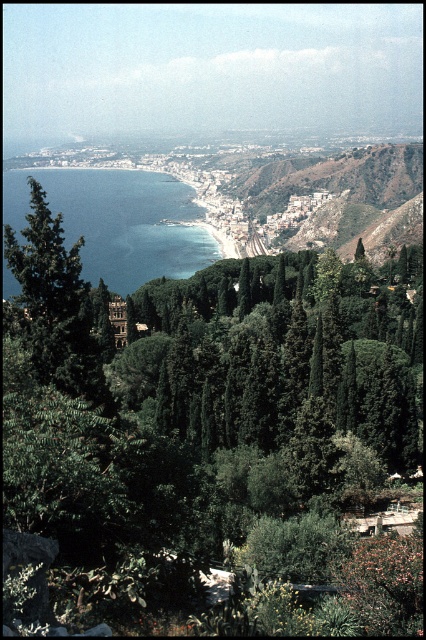
Question: Which object is farther from the camera taking this photo?

Choices:
 (A) green matte tree at left
 (B) blue liquid water at center-left

Answer: (B)

Question: Which is nearer to the green leafy hillside at center?

Choices:
 (A) green matte tree at left
 (B) blue liquid water at center-left

Answer: (B)

Question: Estimate the real-world distances between objects in this image. Which object is closer to the green matte tree at left?

Choices:
 (A) green leafy hillside at center
 (B) blue liquid water at center-left

Answer: (B)

Question: Does green leafy hillside at center have a larger size compared to green matte tree at left?

Choices:
 (A) yes
 (B) no

Answer: (A)

Question: Where is blue liquid water at center-left located in relation to green matte tree at left in the image?

Choices:
 (A) right
 (B) left

Answer: (B)

Question: Where is green leafy hillside at center located in relation to green matte tree at left in the image?

Choices:
 (A) above
 (B) below

Answer: (A)